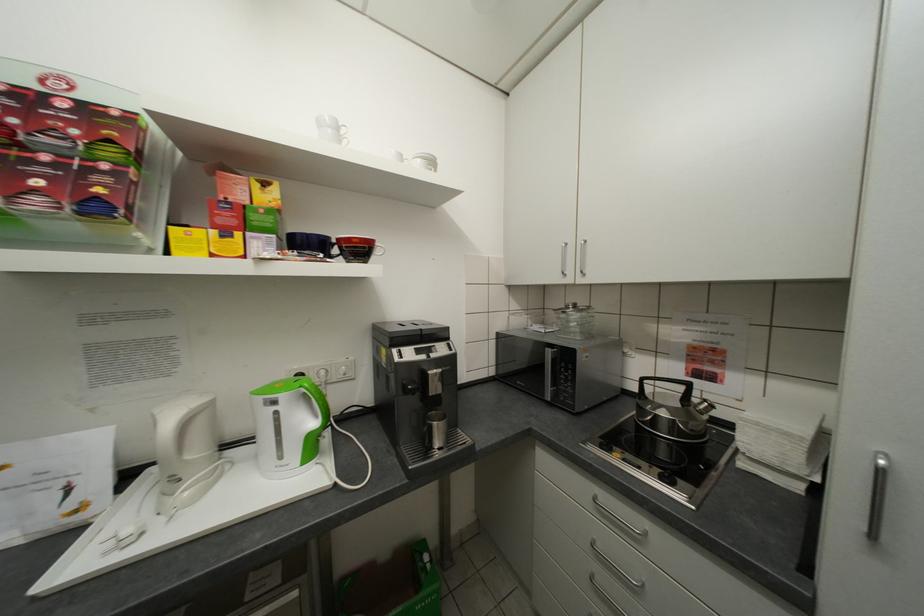
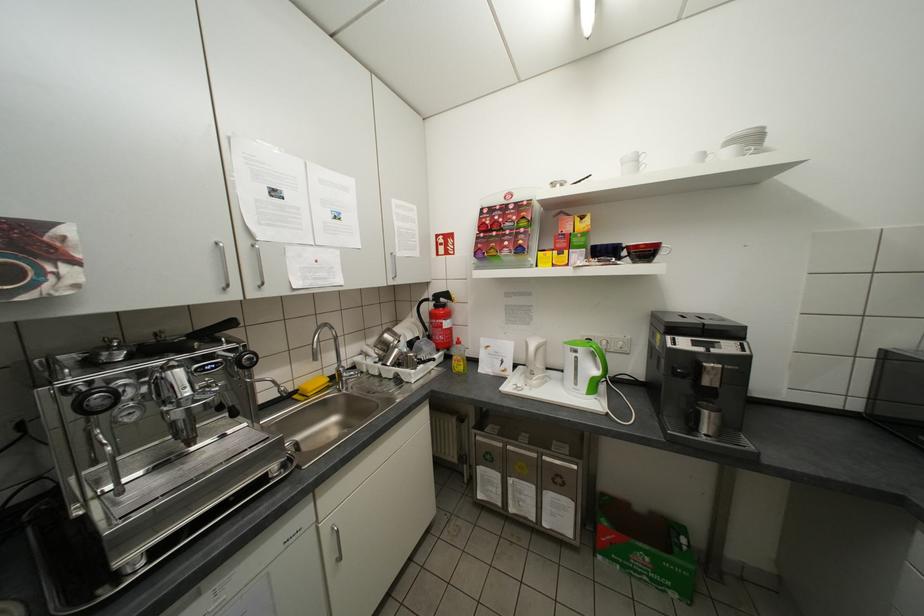
Locate, in the second image, the point that corresponds to the point at 444,371 in the first image.

(721, 365)